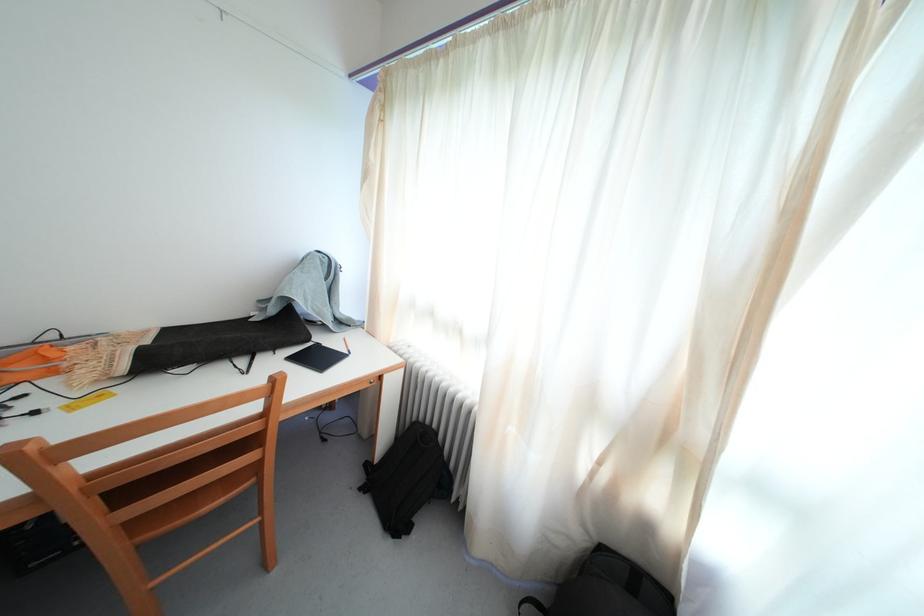
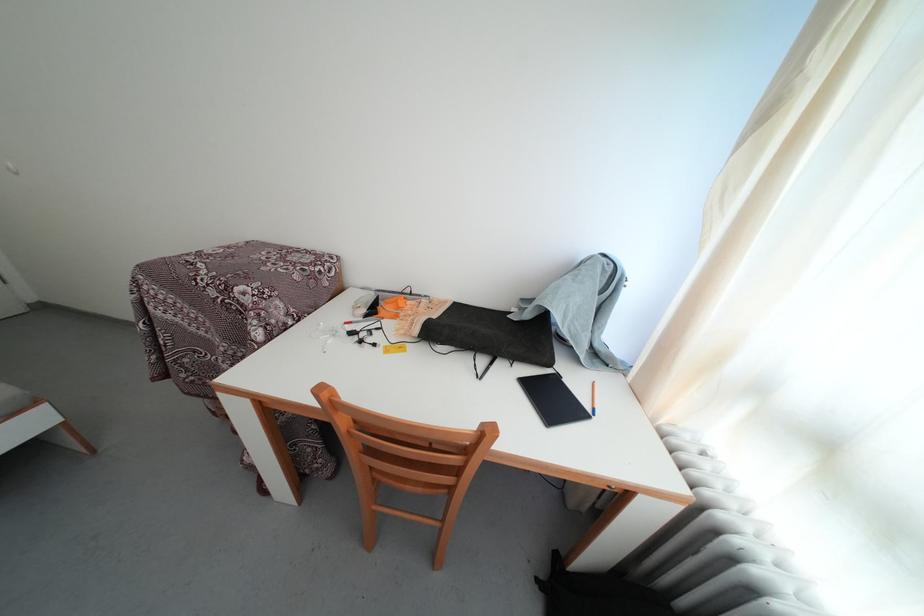
Locate, in the second image, the point that corresponds to the point at 277,317 in the first image.

(533, 322)